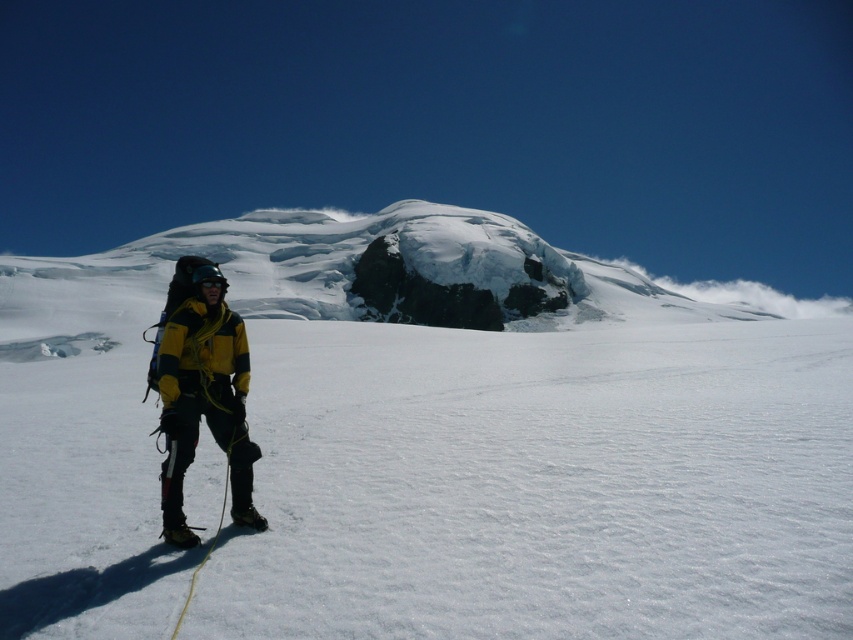
Based on the photo, you are a mountaineer planning to place a safety anchor. You have a white powder snow at center and a yellow fabric jacket at left in your view. Which object is positioned higher from the ground?

The white powder snow at center is located above the yellow fabric jacket at left, so it is positioned higher from the ground.

You are a mountaineer preparing to descend a slope. You have to decide whether to step onto the white powder snow at center or the yellow fabric jacket at left. Which one is farther from your current position?

The white powder snow at center is farther from your current position because it is 333.55 feet away from the yellow fabric jacket at left, so the white powder snow at center is farther away.